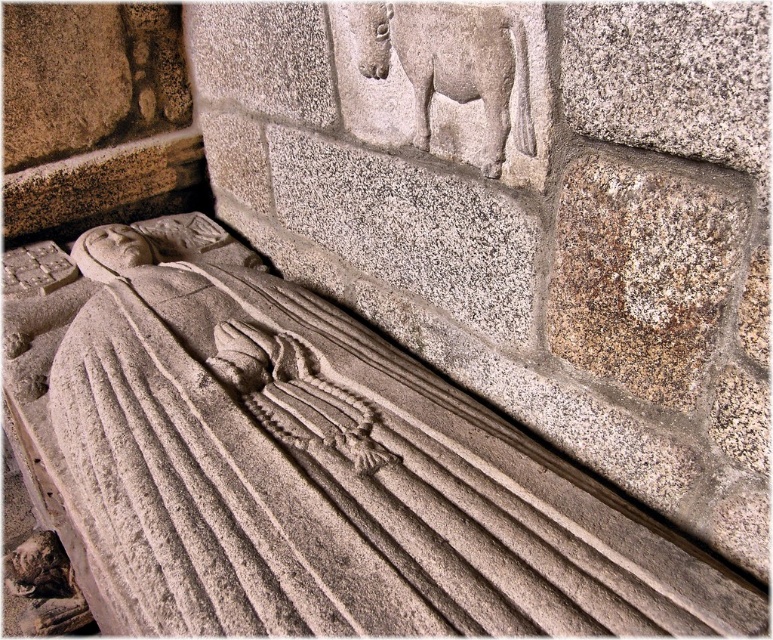
Question: Is gray stone carving at center positioned at the back of gray stone horse at upper center?

Choices:
 (A) yes
 (B) no

Answer: (B)

Question: Which point is closer to the camera?

Choices:
 (A) (482, 68)
 (B) (124, 588)

Answer: (A)

Question: Is gray stone carving at center positioned behind gray stone horse at upper center?

Choices:
 (A) yes
 (B) no

Answer: (B)

Question: Among these points, which one is nearest to the camera?

Choices:
 (A) (424, 100)
 (B) (591, 512)

Answer: (B)

Question: Does gray stone carving at center have a greater width compared to gray stone horse at upper center?

Choices:
 (A) yes
 (B) no

Answer: (A)